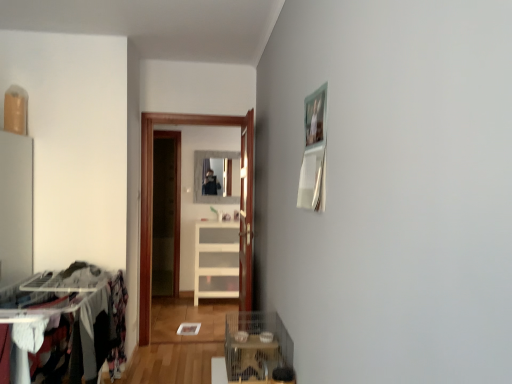
Question: Is transparent glass door at center in contact with metallic wire cage at lower center?

Choices:
 (A) no
 (B) yes

Answer: (A)

Question: Can we say transparent glass door at center lies outside metallic wire cage at lower center?

Choices:
 (A) yes
 (B) no

Answer: (A)

Question: Is transparent glass door at center at the left side of metallic wire cage at lower center?

Choices:
 (A) no
 (B) yes

Answer: (B)

Question: Considering the relative sizes of transparent glass door at center and metallic wire cage at lower center in the image provided, is transparent glass door at center wider than metallic wire cage at lower center?

Choices:
 (A) no
 (B) yes

Answer: (A)

Question: From the image's perspective, is transparent glass door at center above metallic wire cage at lower center?

Choices:
 (A) yes
 (B) no

Answer: (A)

Question: Is white marble mirror at center bigger or smaller than transparent glass door at center?

Choices:
 (A) big
 (B) small

Answer: (B)

Question: In the image, is white marble mirror at center positioned in front of or behind transparent glass door at center?

Choices:
 (A) behind
 (B) front

Answer: (A)

Question: From the image's perspective, is white marble mirror at center above or below transparent glass door at center?

Choices:
 (A) below
 (B) above

Answer: (B)

Question: From a real-world perspective, is white marble mirror at center physically located above or below transparent glass door at center?

Choices:
 (A) above
 (B) below

Answer: (A)

Question: From the image's perspective, is wooden door at center located above or below transparent glass door at center?

Choices:
 (A) below
 (B) above

Answer: (B)

Question: Considering the positions of point (249, 170) and point (248, 220), is point (249, 170) closer or farther from the camera than point (248, 220)?

Choices:
 (A) farther
 (B) closer

Answer: (A)

Question: Is wooden door at center in front of or behind transparent glass door at center in the image?

Choices:
 (A) front
 (B) behind

Answer: (A)

Question: From a real-world perspective, relative to transparent glass door at center, is wooden door at center vertically above or below?

Choices:
 (A) above
 (B) below

Answer: (A)

Question: Looking at their shapes, would you say transparent glass door at center is wider or thinner than wooden door at center?

Choices:
 (A) wide
 (B) thin

Answer: (A)

Question: Is transparent glass door at center inside the boundaries of wooden door at center, or outside?

Choices:
 (A) outside
 (B) inside

Answer: (A)